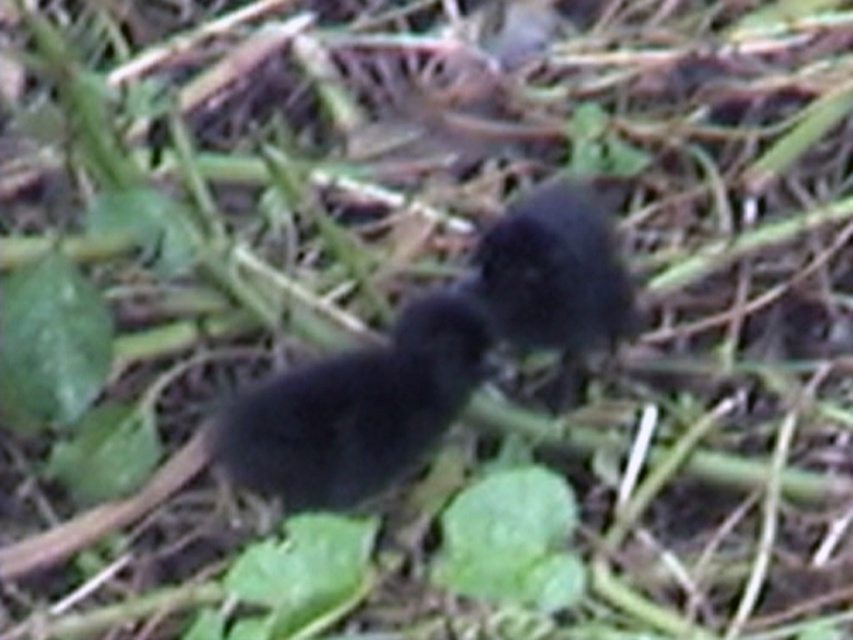
Question: Which point is farther from the camera taking this photo?

Choices:
 (A) [538, 228]
 (B) [273, 440]

Answer: (A)

Question: Is black matte bird at center bigger than black fuzzy bird at center?

Choices:
 (A) yes
 (B) no

Answer: (B)

Question: Which of the following is the farthest from the observer?

Choices:
 (A) (419, 307)
 (B) (572, 218)

Answer: (B)

Question: Is black matte bird at center thinner than black fuzzy bird at center?

Choices:
 (A) yes
 (B) no

Answer: (B)

Question: Does black matte bird at center appear under black fuzzy bird at center?

Choices:
 (A) yes
 (B) no

Answer: (A)